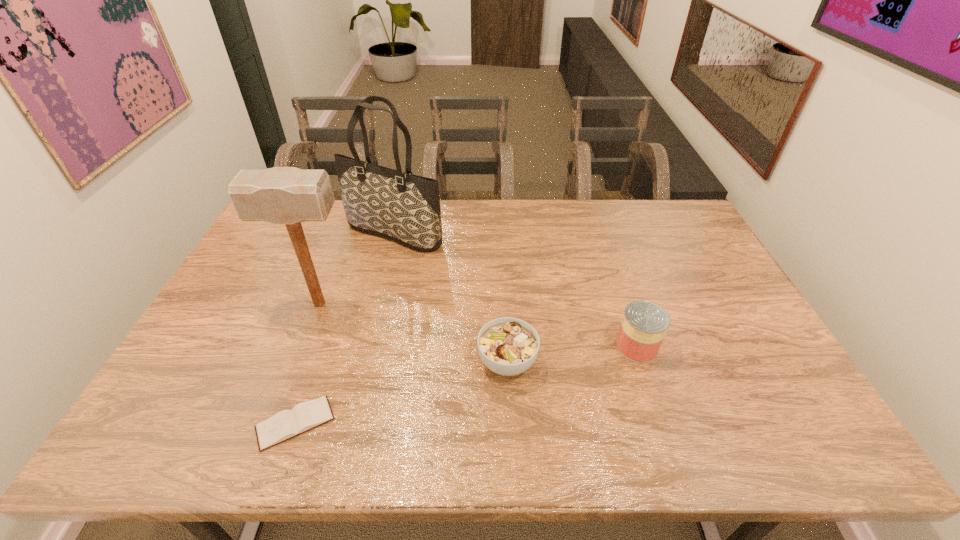
Identify the location of free space located 0.060m on the back of the can. (626, 315).

This screenshot has width=960, height=540. I want to click on vacant space located 0.120m on the right of the second object from right to left, so click(583, 362).

Identify the location of free spot located on the right of the nearest object. (508, 423).

Identify the location of object at the far edge. (399, 206).

Find the location of a particular element. The image size is (960, 540). object positioned at the near edge is located at coordinates (286, 424).

This screenshot has height=540, width=960. Find the location of `free spot at the near edge of the desktop`. free spot at the near edge of the desktop is located at coordinates (411, 456).

Find the location of a particular element. The image size is (960, 540). vacant area at the left edge of the desktop is located at coordinates (224, 313).

Locate an element on the screen. Image resolution: width=960 pixels, height=540 pixels. vacant space at the right edge of the desktop is located at coordinates (686, 295).

What are the coordinates of `vacant space in between the second shortest object and the can` in the screenshot? It's located at (572, 354).

At what (x,y) coordinates should I click in order to perform the action: click on free point between the fourth object from left to right and the second farthest object. Please return your answer as a coordinate pair (x, y). This screenshot has width=960, height=540. Looking at the image, I should click on (414, 333).